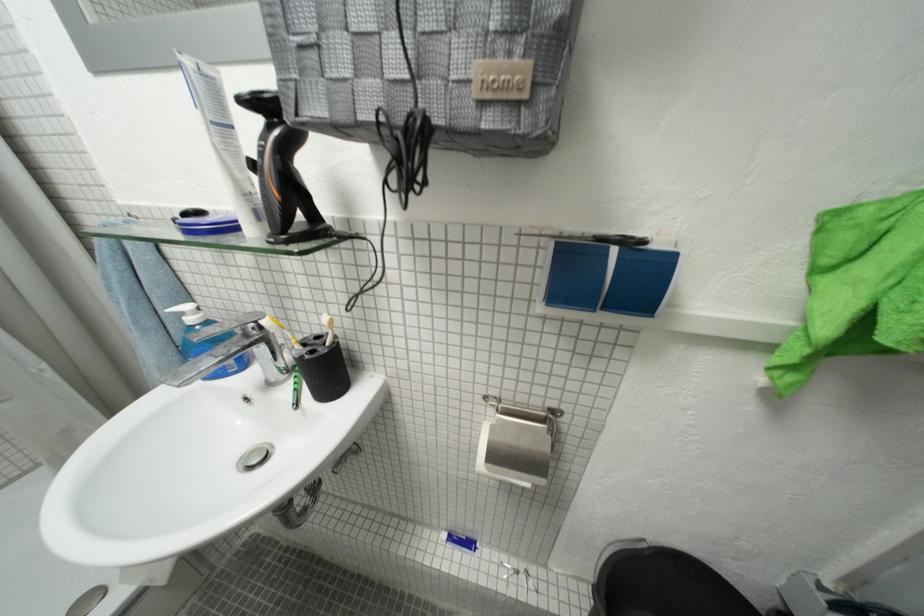
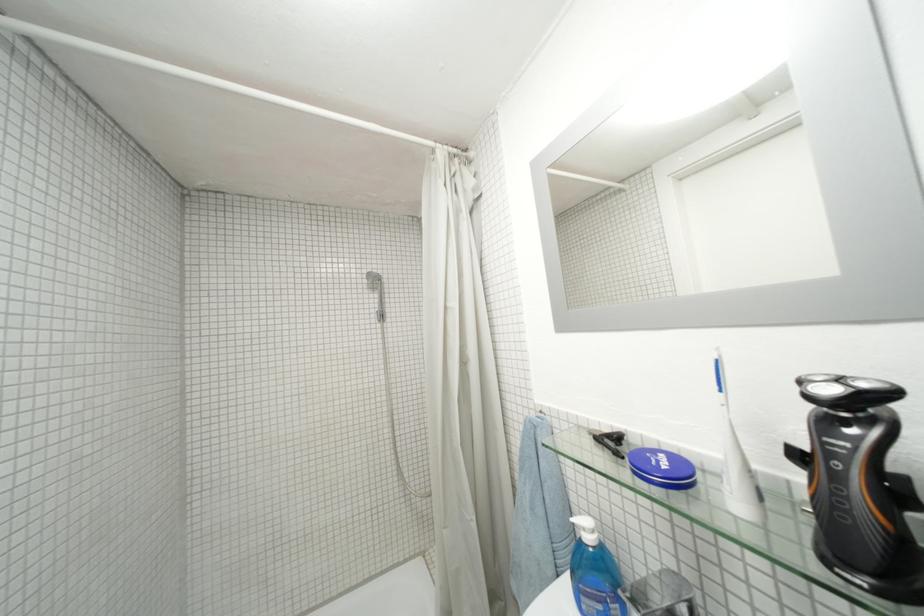
The point at (201, 322) is marked in the first image. Where is the corresponding point in the second image?

(598, 541)